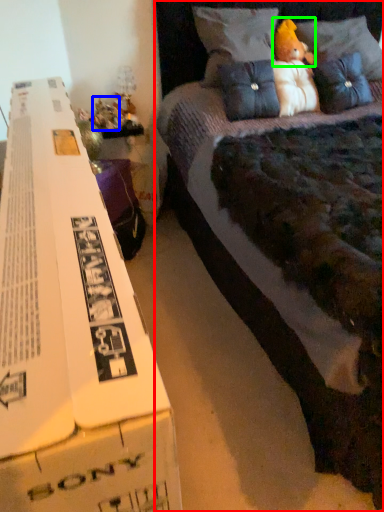
Question: Based on their relative distances, which object is nearer to bed (highlighted by a red box)? Choose from toy (highlighted by a blue box) and toy (highlighted by a green box).

Choices:
 (A) toy
 (B) toy

Answer: (B)